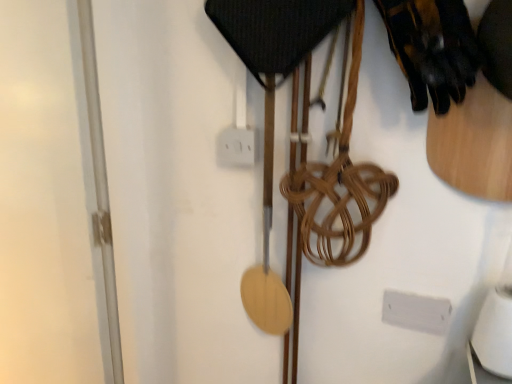
Question: Should I look upward or downward to see black leather gloves at upper right?

Choices:
 (A) down
 (B) up

Answer: (B)

Question: Is transparent glass door at left outside white plastic electric outlet at center?

Choices:
 (A) no
 (B) yes

Answer: (B)

Question: Considering the relative sizes of transparent glass door at left and white plastic electric outlet at center in the image provided, is transparent glass door at left thinner than white plastic electric outlet at center?

Choices:
 (A) no
 (B) yes

Answer: (A)

Question: Can you confirm if transparent glass door at left is taller than white plastic electric outlet at center?

Choices:
 (A) yes
 (B) no

Answer: (A)

Question: Can you confirm if transparent glass door at left is wider than white plastic electric outlet at center?

Choices:
 (A) no
 (B) yes

Answer: (B)

Question: Can you confirm if transparent glass door at left is smaller than white plastic electric outlet at center?

Choices:
 (A) no
 (B) yes

Answer: (A)

Question: From the image's perspective, is transparent glass door at left beneath white plastic electric outlet at center?

Choices:
 (A) no
 (B) yes

Answer: (B)

Question: Is black leather gloves at upper right looking in the opposite direction of white plastic electric outlet at center?

Choices:
 (A) yes
 (B) no

Answer: (B)

Question: Could you tell me if black leather gloves at upper right is facing white plastic electric outlet at center?

Choices:
 (A) no
 (B) yes

Answer: (A)

Question: Does black leather gloves at upper right have a lesser width compared to white plastic electric outlet at center?

Choices:
 (A) no
 (B) yes

Answer: (A)

Question: Is black leather gloves at upper right shorter than white plastic electric outlet at center?

Choices:
 (A) yes
 (B) no

Answer: (B)

Question: Is black leather gloves at upper right bigger than white plastic electric outlet at center?

Choices:
 (A) yes
 (B) no

Answer: (A)

Question: From a real-world perspective, is black leather gloves at upper right over white plastic electric outlet at center?

Choices:
 (A) yes
 (B) no

Answer: (A)

Question: From a real-world perspective, is transparent glass door at left on top of black leather gloves at upper right?

Choices:
 (A) yes
 (B) no

Answer: (B)